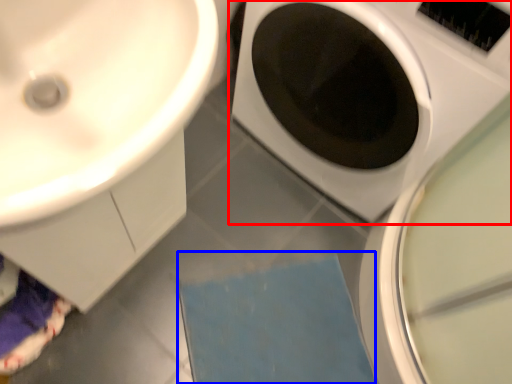
Question: Which object appears closest to the camera in this image, washing machine (highlighted by a red box) or bath mat (highlighted by a blue box)?

Choices:
 (A) washing machine
 (B) bath mat

Answer: (A)